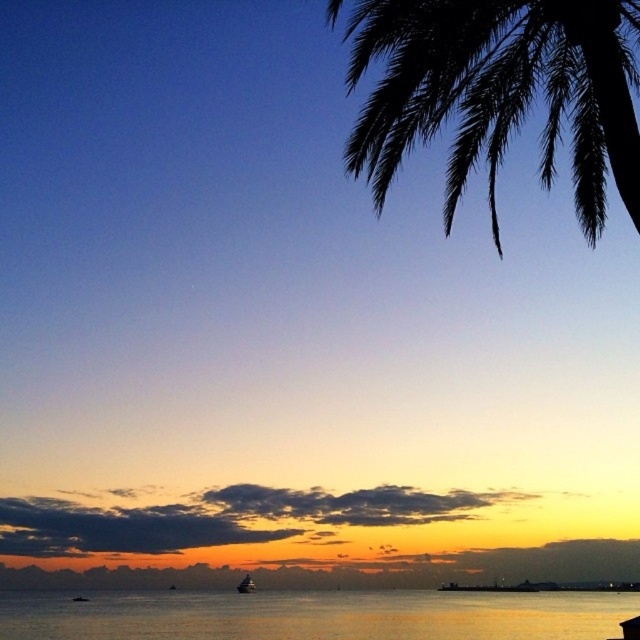
Question: Does silvery reflective water at center appear under smooth orange sky at lower center?

Choices:
 (A) no
 (B) yes

Answer: (A)

Question: In this image, where is silvery reflective water at center located relative to smooth orange sky at lower center?

Choices:
 (A) below
 (B) above

Answer: (B)

Question: Observing the image, what is the correct spatial positioning of silvery reflective water at center in reference to shiny silver boat at lower center?

Choices:
 (A) left
 (B) right

Answer: (B)

Question: Among these objects, which one is farthest from the camera?

Choices:
 (A) silvery reflective water at center
 (B) smooth orange sky at lower center
 (C) silhouette leafy branch at upper right

Answer: (B)

Question: Which point is closer to the camera?

Choices:
 (A) (390, 145)
 (B) (273, 579)
 (C) (557, 611)

Answer: (A)

Question: Which object appears closest to the camera in this image?

Choices:
 (A) silhouette leafy branch at upper right
 (B) smooth orange sky at lower center
 (C) shiny silver boat at lower center

Answer: (A)